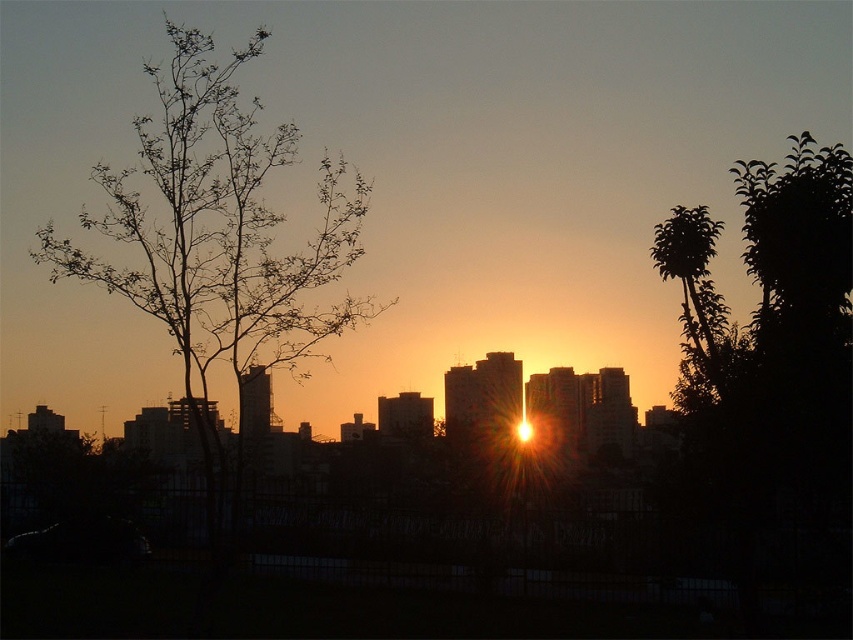
Question: Does bare branches at left come behind green leafy tree at right?

Choices:
 (A) yes
 (B) no

Answer: (B)

Question: Where is bare branches at left located in relation to green leafy tree at right in the image?

Choices:
 (A) left
 (B) right

Answer: (A)

Question: Considering the relative positions of bare branches at left and green leafy tree at right in the image provided, where is bare branches at left located with respect to green leafy tree at right?

Choices:
 (A) left
 (B) right

Answer: (A)

Question: Which object appears farthest from the camera in this image?

Choices:
 (A) bare branches at left
 (B) green leafy tree at right

Answer: (B)

Question: Which point is farther to the camera?

Choices:
 (A) (694, 227)
 (B) (186, 170)

Answer: (A)